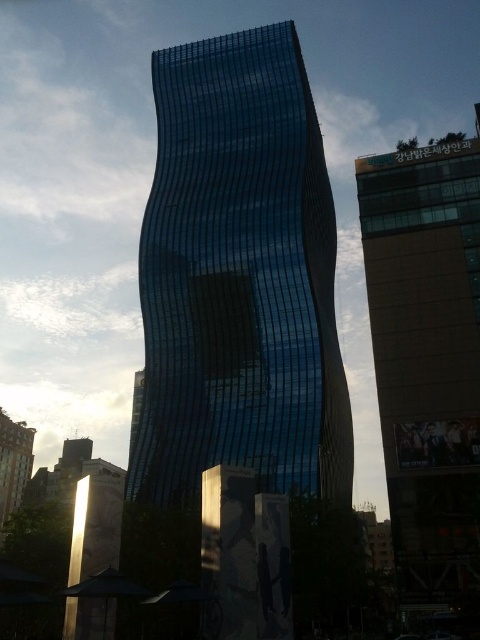
Question: Among these objects, which one is nearest to the camera?

Choices:
 (A) matte glass building at center
 (B) matte glass building at lower left

Answer: (A)

Question: Can you confirm if matte glass building at center is positioned below matte glass building at lower left?

Choices:
 (A) no
 (B) yes

Answer: (A)

Question: Does matte glass building at center appear under matte glass building at lower left?

Choices:
 (A) yes
 (B) no

Answer: (B)

Question: Considering the relative positions of matte glass building at center and matte glass building at lower left in the image provided, where is matte glass building at center located with respect to matte glass building at lower left?

Choices:
 (A) above
 (B) below

Answer: (A)

Question: Which point is closer to the camera?

Choices:
 (A) matte glass building at lower left
 (B) matte glass building at center

Answer: (B)